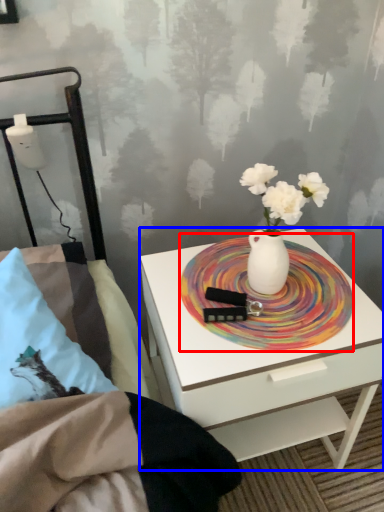
Question: Which object is closer to the camera taking this photo, platter (highlighted by a red box) or nightstand (highlighted by a blue box)?

Choices:
 (A) platter
 (B) nightstand

Answer: (B)